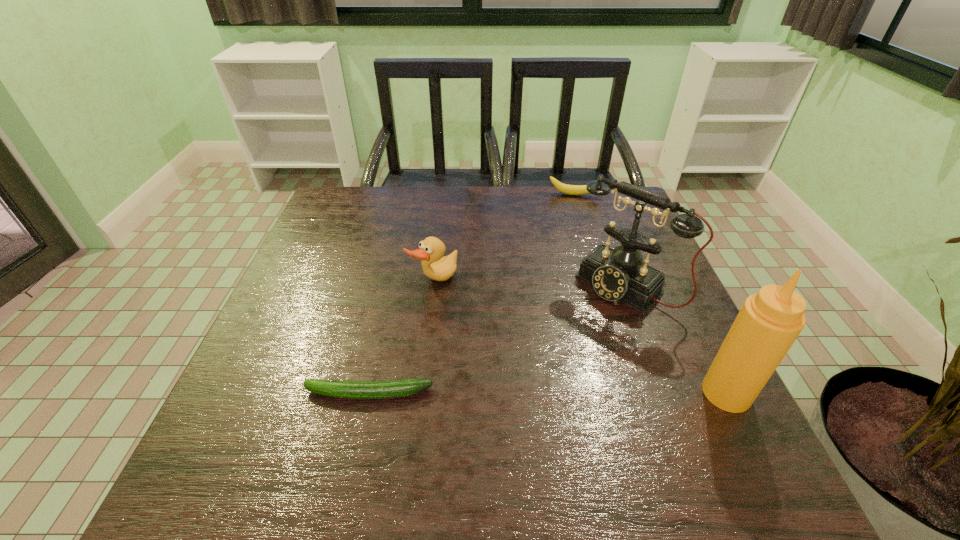
This screenshot has height=540, width=960. I want to click on zucchini, so click(x=397, y=388).

This screenshot has width=960, height=540. What are the coordinates of `condiment` in the screenshot? It's located at (769, 322).

The width and height of the screenshot is (960, 540). What are the coordinates of `banana` in the screenshot? It's located at (564, 188).

Where is `the fourth tallest object`? Image resolution: width=960 pixels, height=540 pixels. the fourth tallest object is located at coordinates (564, 188).

Locate an element on the screen. Image resolution: width=960 pixels, height=540 pixels. duck is located at coordinates (435, 266).

Where is `the fourth shortest object`? The image size is (960, 540). the fourth shortest object is located at coordinates (x=616, y=274).

The width and height of the screenshot is (960, 540). What are the coordinates of `vacant area situated on the front-facing side of the zucchini` in the screenshot? It's located at (267, 393).

Locate an element on the screen. free spot located on the front-facing side of the zucchini is located at coordinates (273, 393).

This screenshot has height=540, width=960. I want to click on free region located 0.090m on the front-facing side of the zucchini, so click(x=256, y=393).

At what (x,y) coordinates should I click in order to perform the action: click on vacant space located 0.290m on the left of the condiment. Please return your answer as a coordinate pair (x, y). Image resolution: width=960 pixels, height=540 pixels. Looking at the image, I should click on (549, 393).